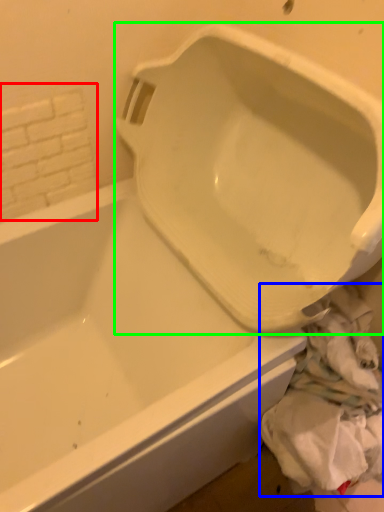
Question: Which is farther away from tile (highlighted by a red box)? material (highlighted by a blue box) or urinal (highlighted by a green box)?

Choices:
 (A) material
 (B) urinal

Answer: (A)